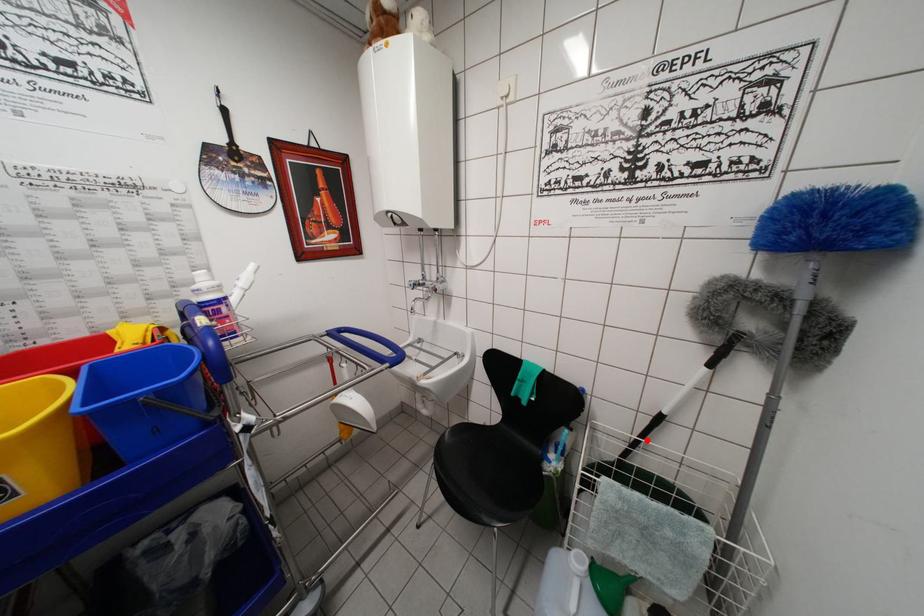
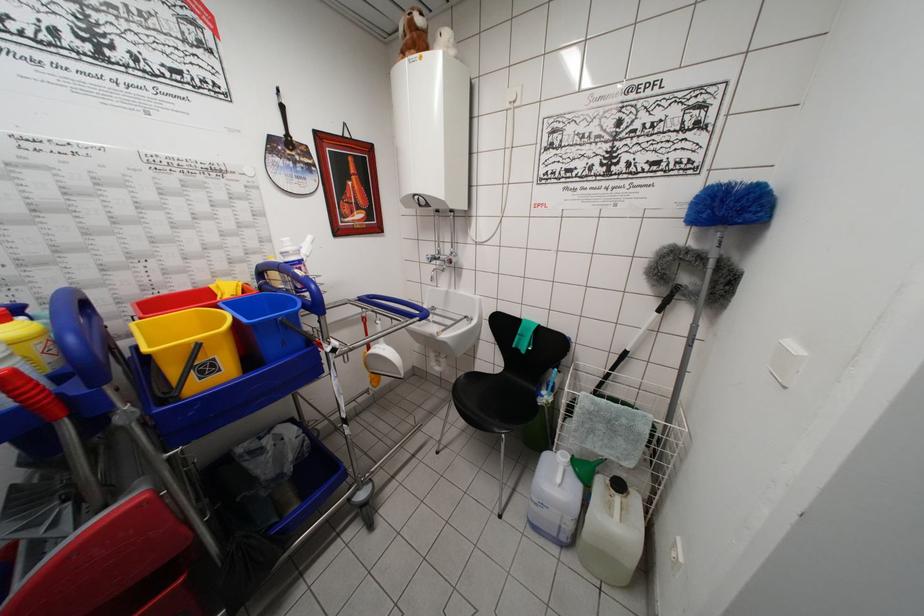
In the second image, find the point that corresponds to the highlighted location in the first image.

(616, 374)